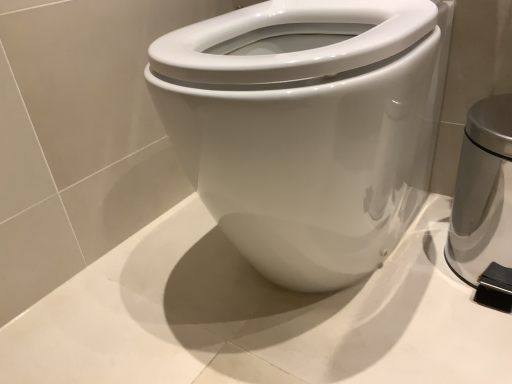
Image resolution: width=512 pixels, height=384 pixels. Identify the location of white glossy bidet at center. (304, 129).

What do you see at coordinates (304, 129) in the screenshot? The height and width of the screenshot is (384, 512). I see `white glossy bidet at center` at bounding box center [304, 129].

Describe the element at coordinates (484, 204) in the screenshot. I see `satin silver trash can at right` at that location.

Where is `satin silver trash can at right`? The width and height of the screenshot is (512, 384). satin silver trash can at right is located at coordinates (484, 204).

Identify the location of white glossy bidet at center. (304, 129).

Can you confirm if white glossy bidet at center is positioned to the right of satin silver trash can at right?

In fact, white glossy bidet at center is to the left of satin silver trash can at right.

In the scene shown: Considering the positions of objects white glossy bidet at center and satin silver trash can at right in the image provided, who is behind, white glossy bidet at center or satin silver trash can at right?

satin silver trash can at right is more distant.

Does point (320, 153) lie in front of point (500, 179)?

Yes, it is.

From the image's perspective, is white glossy bidet at center above satin silver trash can at right?

Yes.

From a real-world perspective, which object rests below the other?

satin silver trash can at right is physically lower.

From the picture: Considering the relative sizes of white glossy bidet at center and satin silver trash can at right in the image provided, is white glossy bidet at center wider than satin silver trash can at right?

Yes, white glossy bidet at center is wider than satin silver trash can at right.

From their relative heights in the image, would you say white glossy bidet at center is taller or shorter than satin silver trash can at right?

Considering their sizes, white glossy bidet at center has more height than satin silver trash can at right.

Which of these two, white glossy bidet at center or satin silver trash can at right, is bigger?

Bigger between the two is white glossy bidet at center.

Is white glossy bidet at center positioned beyond the bounds of satin silver trash can at right?

Yes, white glossy bidet at center is not within satin silver trash can at right.

Is white glossy bidet at center not near satin silver trash can at right?

No, white glossy bidet at center is in close proximity to satin silver trash can at right.

From the picture: Is white glossy bidet at center positioned with its back to satin silver trash can at right?

No, white glossy bidet at center is not facing the opposite direction of satin silver trash can at right.

At what (x,y) coordinates should I click in order to perform the action: click on bidet that appears above the satin silver trash can at right (from the image's perspective). Please return your answer as a coordinate pair (x, y). Looking at the image, I should click on (304, 129).

Considering the relative positions of satin silver trash can at right and white glossy bidet at center in the image provided, is satin silver trash can at right to the right of white glossy bidet at center from the viewer's perspective?

Yes.

Is satin silver trash can at right positioned in front of white glossy bidet at center?

No.

Is point (484, 278) farther from camera compared to point (345, 66)?

That is True.

From the image's perspective, is satin silver trash can at right located above or below white glossy bidet at center?

From the image's perspective, satin silver trash can at right appears below white glossy bidet at center.

Consider the image. From a real-world perspective, is satin silver trash can at right positioned over white glossy bidet at center based on gravity?

No, from a real-world perspective, satin silver trash can at right is not on top of white glossy bidet at center.

Is satin silver trash can at right thinner than white glossy bidet at center?

Yes, satin silver trash can at right is thinner than white glossy bidet at center.

Considering the sizes of objects satin silver trash can at right and white glossy bidet at center in the image provided, who is shorter, satin silver trash can at right or white glossy bidet at center?

satin silver trash can at right.

Is satin silver trash can at right bigger or smaller than white glossy bidet at center?

→ Clearly, satin silver trash can at right is smaller in size than white glossy bidet at center.

Is white glossy bidet at center located within satin silver trash can at right?

No, white glossy bidet at center is located outside of satin silver trash can at right.

Is satin silver trash can at right not near white glossy bidet at center?

That's not correct — satin silver trash can at right is a little close to white glossy bidet at center.

Is satin silver trash can at right turned away from white glossy bidet at center?

No, satin silver trash can at right is not facing the opposite direction of white glossy bidet at center.

What's the angular difference between satin silver trash can at right and white glossy bidet at center's facing directions?

There is a 1.53-degree angle between the facing directions of satin silver trash can at right and white glossy bidet at center.

Locate an element on the screen. The image size is (512, 384). bidet above the satin silver trash can at right (from a real-world perspective) is located at coordinates coord(304,129).

Where is `bidet above the satin silver trash can at right (from the image's perspective)`? bidet above the satin silver trash can at right (from the image's perspective) is located at coordinates (304, 129).

You are a GUI agent. You are given a task and a screenshot of the screen. Output one action in this format:
    pyautogui.click(x=<x>, y=<y>)
    Task: Click on the bidet on the left of satin silver trash can at right
    This screenshot has width=512, height=384.
    Given the screenshot: What is the action you would take?
    pyautogui.click(x=304, y=129)